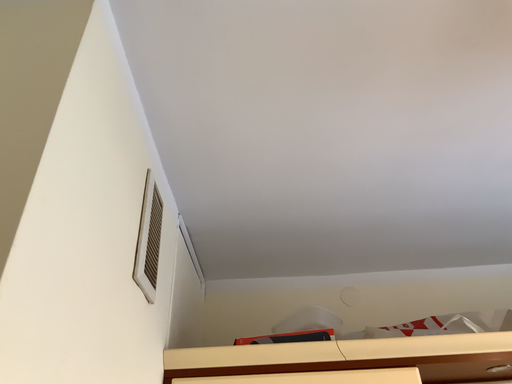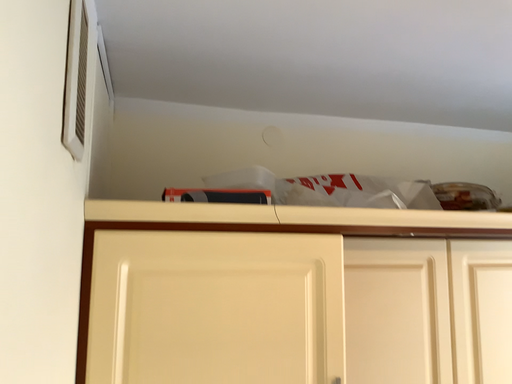
Question: How did the camera likely rotate when shooting the video?

Choices:
 (A) rotated left
 (B) rotated right

Answer: (B)